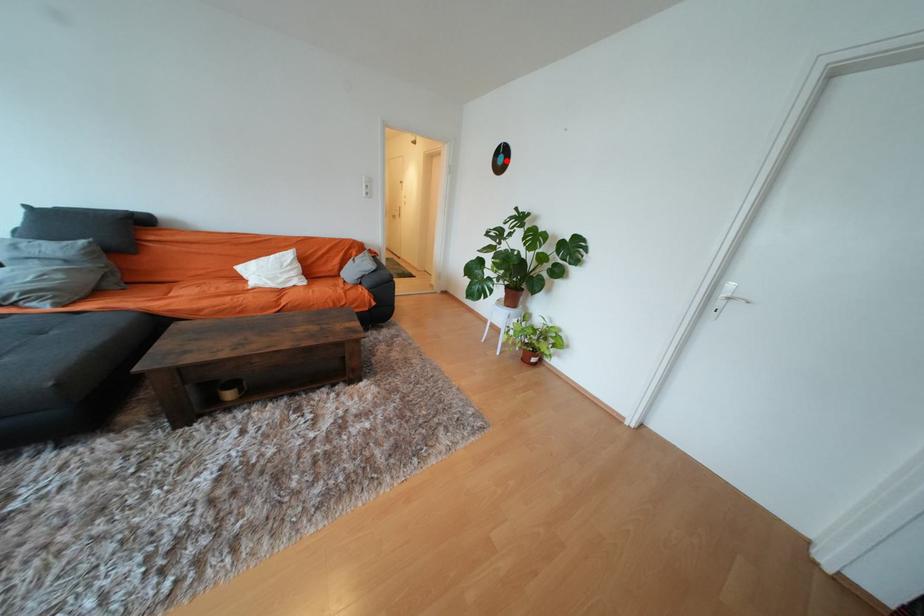
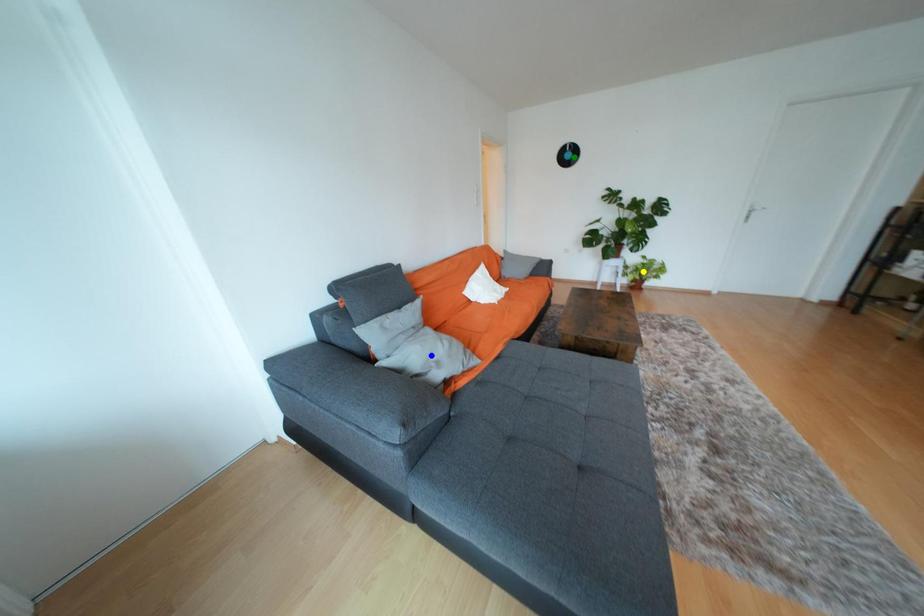
Question: I am providing you with two images of the same scene from different viewpoints. A red point is marked on the first image. You are given multiple points on the second image. In image 2, which mark is for the same physical point as the one in image 1?

Choices:
 (A) yellow point
 (B) green point
 (C) blue point

Answer: (B)